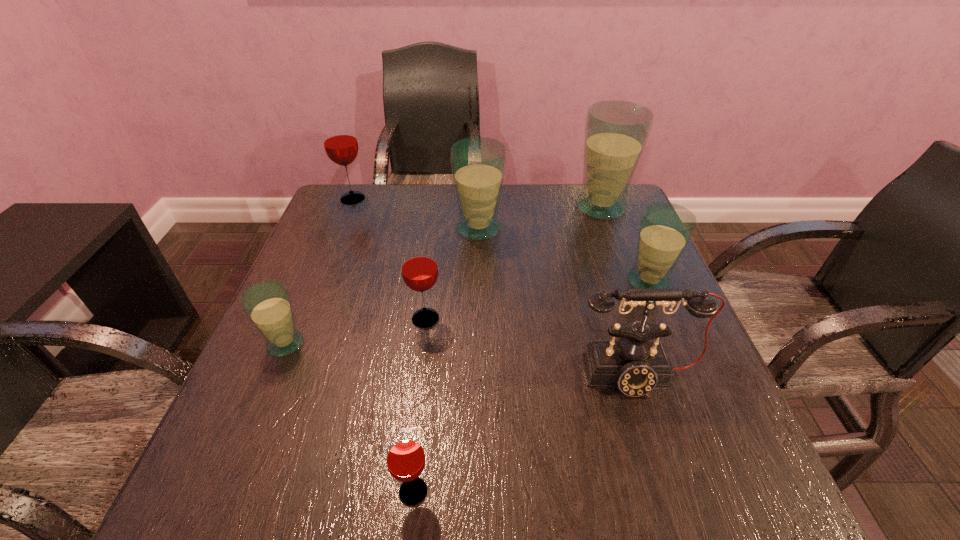
The height and width of the screenshot is (540, 960). In order to click on vacant space located on the front of the nearest blue glass in this screenshot , I will do `click(219, 503)`.

You are a GUI agent. You are given a task and a screenshot of the screen. Output one action in this format:
    pyautogui.click(x=<x>, y=<y>)
    Task: Click on the vacant area located 0.140m on the right of the nearest glass
    This screenshot has width=960, height=540.
    Given the screenshot: What is the action you would take?
    pyautogui.click(x=524, y=491)

Where is `object that is at the near edge`? The image size is (960, 540). object that is at the near edge is located at coordinates (405, 457).

The width and height of the screenshot is (960, 540). I want to click on telephone that is at the right edge, so click(635, 364).

Locate an element on the screen. object present at the far left corner is located at coordinates (340, 143).

This screenshot has width=960, height=540. In order to click on object present at the far right corner in this screenshot , I will do `click(616, 132)`.

Image resolution: width=960 pixels, height=540 pixels. In the image, there is a desktop. Identify the location of vacant area at the far edge. (400, 200).

The width and height of the screenshot is (960, 540). In the image, there is a desktop. What are the coordinates of `vacant space at the near edge` in the screenshot? It's located at (340, 477).

In the image, there is a desktop. Identify the location of vacant area at the left edge. The width and height of the screenshot is (960, 540). (333, 348).

The image size is (960, 540). I want to click on vacant space at the right edge of the desktop, so click(x=601, y=256).